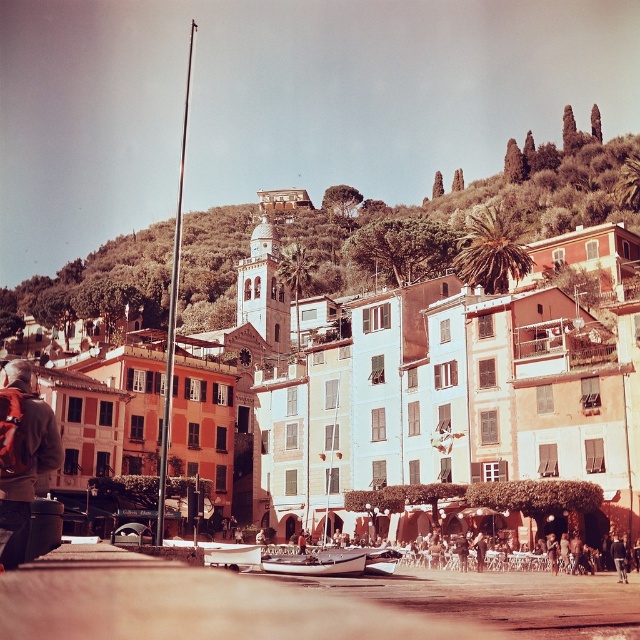
You are standing at the edge of the coastal town and want to take a photo of the matte stone buildings at center. If your camera can focus on objects up to 50 meters away, will you need to move closer to get a clear shot?

The matte stone buildings at center is 53.49 meters from viewer, so you need to move closer to ensure the camera can focus properly.

You are a tourist visiting this coastal town and want to take a photo that includes both the matte stone buildings at center and the metallic silver boat at lower center. Which object should you position closer to the camera to ensure both are fully visible in your photo?

You should position the metallic silver boat at lower center closer to the camera because the matte stone buildings at center are much taller, so bringing the boat forward will help balance their sizes in the frame.